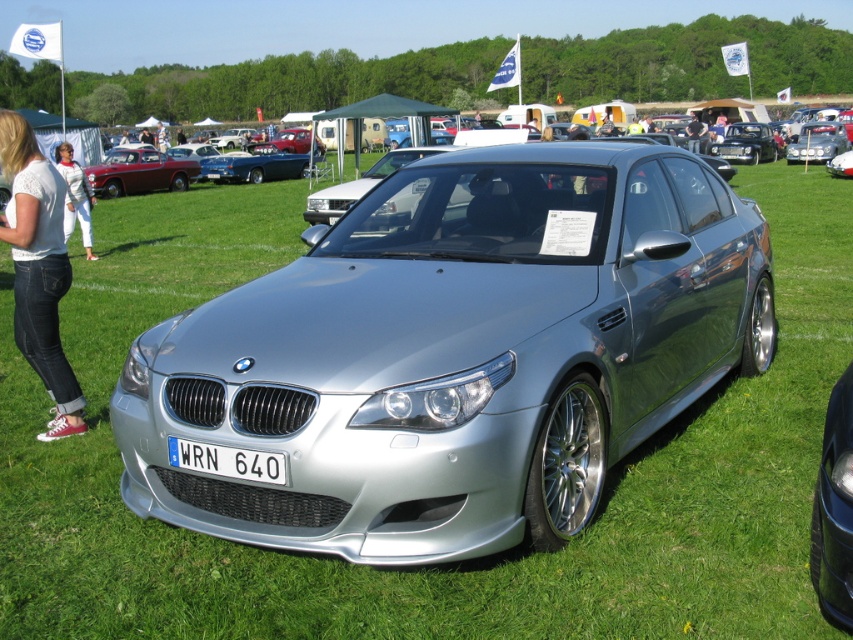
You are standing at the edge of a grassy field where a silver BMW is displayed. You notice a point marked at coordinates (834, 509). Based on the scene, can you determine which object this point is located on?

The point at coordinates (834, 509) is located on the silver metallic car at center.

In the scene shown: You are standing in front of the silver BMW car at the car show. There are two points marked on the car. One is at coordinate point (827, 532) and the other is at point (143, 172). Which of these points is closer to you?

Point (827, 532) is closer to the camera than point (143, 172), so the point at coordinate point (827, 532) is closer to you.